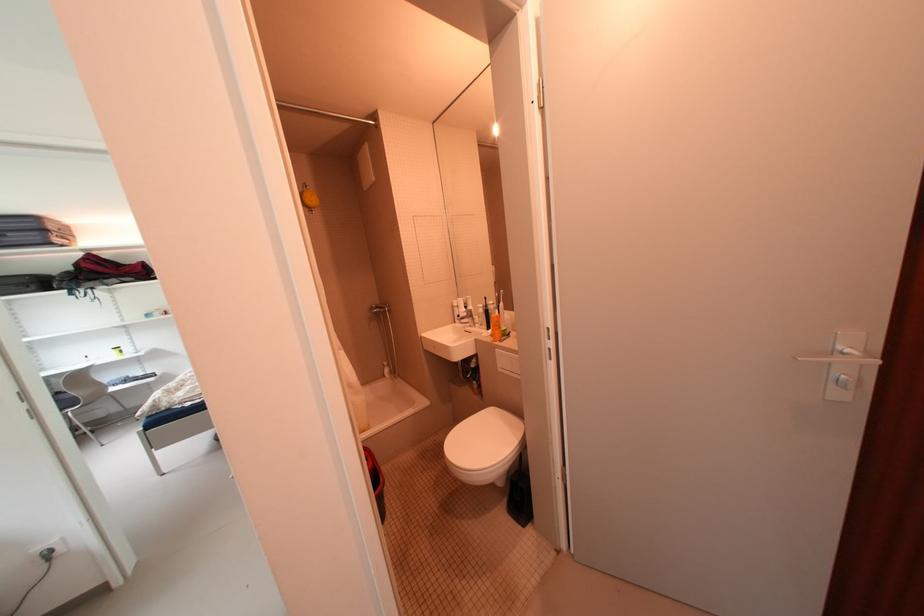
Find where to turn the shower control knob. Please return your answer as a coordinate pair (x, y).

(396, 310)